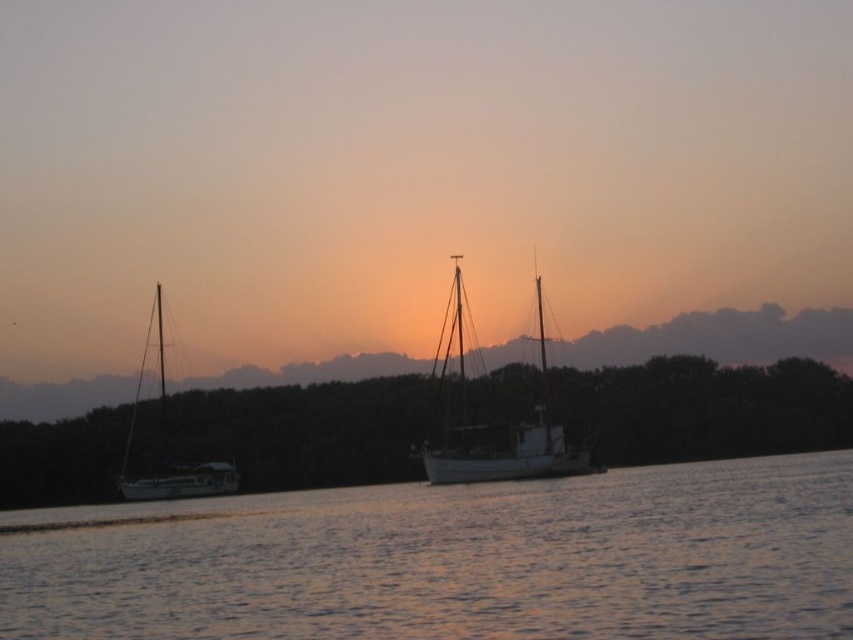
Question: Which of the following is the closest to the observer?

Choices:
 (A) (250, 532)
 (B) (537, 452)
 (C) (160, 477)

Answer: (A)

Question: Does smooth water at center have a smaller size compared to white matte sailboat at left?

Choices:
 (A) no
 (B) yes

Answer: (B)

Question: Among these points, which one is nearest to the camera?

Choices:
 (A) (508, 561)
 (B) (207, 474)
 (C) (544, 385)

Answer: (A)

Question: Is white matte sailboat at center thinner than white matte sailboat at left?

Choices:
 (A) no
 (B) yes

Answer: (B)

Question: Which point is farther to the camera?

Choices:
 (A) (148, 534)
 (B) (437, 464)
 (C) (152, 480)

Answer: (C)

Question: Can you confirm if smooth water at center is positioned below white matte sailboat at left?

Choices:
 (A) yes
 (B) no

Answer: (A)